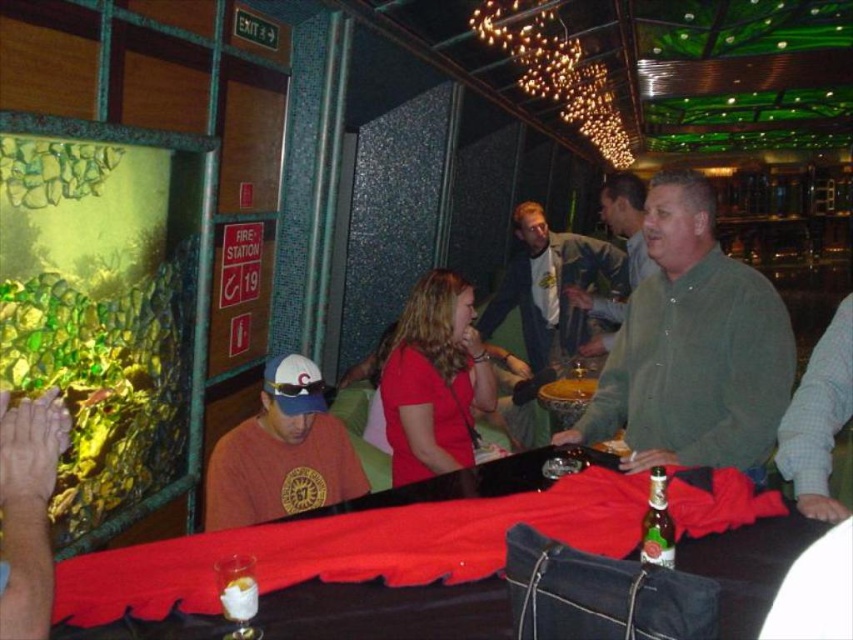
Question: Which point is farther to the camera?

Choices:
 (A) matte red shirt at center
 (B) green matte shirt at center
 (C) green cotton shirt at center

Answer: (C)

Question: Which object appears farthest from the camera in this image?

Choices:
 (A) green cotton shirt at center
 (B) green corduroy shirt at center
 (C) matte red shirt at center
 (D) smooth wooden bowl at center

Answer: (A)

Question: Is matte red shirt at center wider than smooth wooden bowl at center?

Choices:
 (A) yes
 (B) no

Answer: (A)

Question: Can you confirm if green corduroy shirt at center is positioned above white creamy dessert at center?

Choices:
 (A) yes
 (B) no

Answer: (A)

Question: Which point appears farthest from the camera in this image?

Choices:
 (A) (614, 444)
 (B) (670, 548)

Answer: (A)

Question: From the image, what is the correct spatial relationship of green corduroy shirt at center in relation to matte orange shirt at center?

Choices:
 (A) left
 (B) right

Answer: (B)